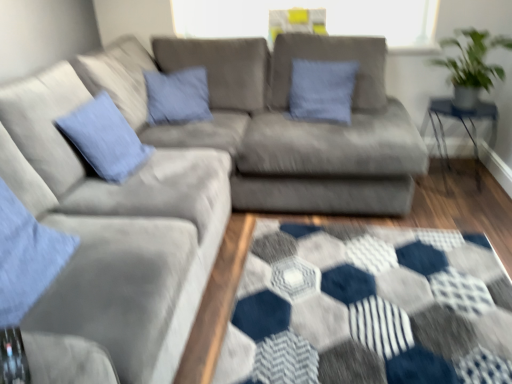
Question: Which direction should I rotate to look at blue cotton pillow at center, acting as the 2th pillow starting from the left, — up or down?

Choices:
 (A) down
 (B) up

Answer: (B)

Question: Is the surface of blue cotton pillow at left, which appears as the 2th pillow when viewed from the back, in direct contact with blue cotton pillow at center, which is the first pillow in right-to-left order?

Choices:
 (A) yes
 (B) no

Answer: (B)

Question: Considering the relative sizes of blue cotton pillow at left, which appears as the 2th pillow when viewed from the back, and blue cotton pillow at center, acting as the 2th pillow starting from the left, in the image provided, is blue cotton pillow at left, which appears as the 2th pillow when viewed from the back, smaller than blue cotton pillow at center, acting as the 2th pillow starting from the left,?

Choices:
 (A) no
 (B) yes

Answer: (A)

Question: From the image's perspective, would you say blue cotton pillow at left, the 2th pillow viewed from the right, is positioned over blue cotton pillow at center, positioned as the 1th pillow in back-to-front order?

Choices:
 (A) no
 (B) yes

Answer: (A)

Question: Considering the relative sizes of blue cotton pillow at left, the 2th pillow viewed from the right, and blue cotton pillow at center, the second pillow when ordered from front to back, in the image provided, is blue cotton pillow at left, the 2th pillow viewed from the right, shorter than blue cotton pillow at center, the second pillow when ordered from front to back,?

Choices:
 (A) yes
 (B) no

Answer: (A)

Question: Is blue cotton pillow at left, the 2th pillow viewed from the right, positioned in front of blue cotton pillow at center, acting as the 2th pillow starting from the left?

Choices:
 (A) yes
 (B) no

Answer: (A)

Question: Is blue cotton pillow at left, which appears as the 2th pillow when viewed from the back, bigger than blue cotton pillow at center, which is the first pillow in right-to-left order?

Choices:
 (A) yes
 (B) no

Answer: (A)

Question: Is blue cotton pillow at center, the second pillow when ordered from front to back, positioned in front of green leafy plant at upper right?

Choices:
 (A) no
 (B) yes

Answer: (A)

Question: From a real-world perspective, is blue cotton pillow at center, which is the first pillow in right-to-left order, located higher than green leafy plant at upper right?

Choices:
 (A) yes
 (B) no

Answer: (B)

Question: Is blue cotton pillow at center, which is the first pillow in right-to-left order, not inside green leafy plant at upper right?

Choices:
 (A) no
 (B) yes

Answer: (B)

Question: Is blue cotton pillow at center, the second pillow when ordered from front to back, not close to green leafy plant at upper right?

Choices:
 (A) no
 (B) yes

Answer: (A)

Question: Considering the relative sizes of blue cotton pillow at center, which is the first pillow in right-to-left order, and green leafy plant at upper right in the image provided, is blue cotton pillow at center, which is the first pillow in right-to-left order, wider than green leafy plant at upper right?

Choices:
 (A) yes
 (B) no

Answer: (B)

Question: Is blue cotton pillow at center, which is the first pillow in right-to-left order, positioned behind green leafy plant at upper right?

Choices:
 (A) no
 (B) yes

Answer: (B)

Question: From the image's perspective, is green leafy plant at upper right under clear glass table at right?

Choices:
 (A) no
 (B) yes

Answer: (A)